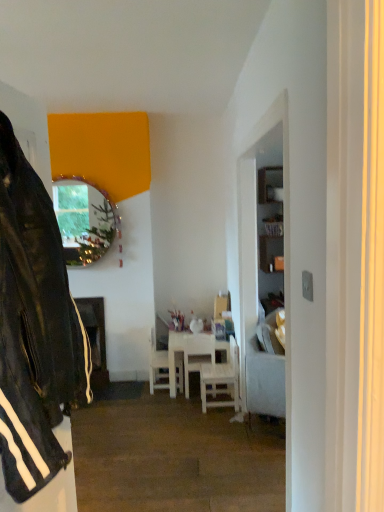
What do you see at coordinates (84, 220) in the screenshot?
I see `metallic reflective mirror at upper left` at bounding box center [84, 220].

Measure the distance between point (177, 356) and camera.

Point (177, 356) is 3.74 meters away from camera.

This screenshot has width=384, height=512. What do you see at coordinates (34, 328) in the screenshot? I see `black leather jacket at left` at bounding box center [34, 328].

What do you see at coordinates (192, 354) in the screenshot?
I see `white wooden table at center` at bounding box center [192, 354].

Describe the element at coordinates (197, 354) in the screenshot. I see `white wood chair at center, the 2th chair when ordered from right to left` at that location.

Image resolution: width=384 pixels, height=512 pixels. What are the coordinates of `metallic reflective mirror at upper left` in the screenshot? It's located at (84, 220).

Who is more distant, white wood chair at center, the 1th chair from the left, or white wood chair at center, which is the 2th chair from left to right?

white wood chair at center, the 1th chair from the left, is further from the camera.

Does point (155, 358) lie in front of point (186, 384)?

No.

Is white wood chair at center, the 1th chair from the left, with white wood chair at center, the 2th chair when ordered from right to left?

white wood chair at center, the 1th chair from the left, and white wood chair at center, the 2th chair when ordered from right to left, are clearly separated.

Is white wood chair at center, which is the 3th chair from right to left, oriented towards white wood chair at center, the 2th chair when ordered from right to left?

Yes, white wood chair at center, which is the 3th chair from right to left, is turned towards white wood chair at center, the 2th chair when ordered from right to left.

Where is `mirror above the black leather jacket at left (from a real-world perspective)`? The height and width of the screenshot is (512, 384). mirror above the black leather jacket at left (from a real-world perspective) is located at coordinates (84, 220).

Is black leather jacket at left at the left side of metallic reflective mirror at upper left?

Incorrect, black leather jacket at left is not on the left side of metallic reflective mirror at upper left.

From a real-world perspective, between black leather jacket at left and metallic reflective mirror at upper left, who is vertically lower?

black leather jacket at left, from a real-world perspective.

Measure the distance between black leather jacket at left and metallic reflective mirror at upper left.

2.49 meters.

Which is in front, point (63, 226) or point (227, 401)?

The point (227, 401) is more forward.

Can you confirm if metallic reflective mirror at upper left is wider than white wooden chair at center, which is the 1th chair from right to left?

Incorrect, the width of metallic reflective mirror at upper left does not surpass that of white wooden chair at center, which is the 1th chair from right to left.

Is the position of metallic reflective mirror at upper left less distant than that of white wooden chair at center, which ranks as the 3th chair in left-to-right order?

No, it is behind white wooden chair at center, which ranks as the 3th chair in left-to-right order.

Is metallic reflective mirror at upper left oriented away from white wooden chair at center, which ranks as the 3th chair in left-to-right order?

No, metallic reflective mirror at upper left is not facing away from white wooden chair at center, which ranks as the 3th chair in left-to-right order.

Based on the photo, can we say white wood chair at center, which is the 2th chair from left to right, lies outside white wooden chair at center, which ranks as the 3th chair in left-to-right order?

Yes.

Based on the photo, who is smaller, white wood chair at center, which is the 2th chair from left to right, or white wooden chair at center, which is the 1th chair from right to left?

With smaller size is white wood chair at center, which is the 2th chair from left to right.

How different are the orientations of white wood chair at center, the 2th chair when ordered from right to left, and white wooden chair at center, which is the 1th chair from right to left, in degrees?

87.8 degrees separate the facing orientations of white wood chair at center, the 2th chair when ordered from right to left, and white wooden chair at center, which is the 1th chair from right to left.

Is white wood chair at center, which is the 2th chair from left to right, placed right next to white wooden chair at center, which ranks as the 3th chair in left-to-right order?

white wood chair at center, which is the 2th chair from left to right, and white wooden chair at center, which ranks as the 3th chair in left-to-right order, are not in contact.

From the image's perspective, relative to black leather jacket at left, is light gray fabric couch at right above or below?

Clearly, from the image's perspective, light gray fabric couch at right is below black leather jacket at left.

Is light gray fabric couch at right behind black leather jacket at left?

Yes, light gray fabric couch at right is behind black leather jacket at left.

Can you confirm if light gray fabric couch at right is shorter than black leather jacket at left?

Yes.

You are a GUI agent. You are given a task and a screenshot of the screen. Output one action in this format:
    pyautogui.click(x=<x>, y=<y>)
    Task: Click on the leather jacket that appears on the left of light gray fabric couch at right
    
    Given the screenshot: What is the action you would take?
    pyautogui.click(x=34, y=328)

Which of these two, white wood chair at center, which is the 2th chair from left to right, or black leather jacket at left, is thinner?

Thinner between the two is black leather jacket at left.

From a real-world perspective, between white wood chair at center, which is the 2th chair from left to right, and black leather jacket at left, who is vertically lower?

white wood chair at center, which is the 2th chair from left to right, from a real-world perspective.

Is white wood chair at center, which is the 2th chair from left to right, far away from black leather jacket at left?

Yes, white wood chair at center, which is the 2th chair from left to right, is far from black leather jacket at left.

Image resolution: width=384 pixels, height=512 pixels. There is a black leather jacket at left. What are the coordinates of `the 2nd chair below it (from a real-world perspective)` in the screenshot? It's located at (197, 354).

From the image's perspective, is white wood chair at center, which is the 3th chair from right to left, beneath light gray fabric couch at right?

Yes.

Is light gray fabric couch at right at the back of white wood chair at center, the 1th chair from the left?

No, light gray fabric couch at right is not at the back of white wood chair at center, the 1th chair from the left.

How many degrees apart are the facing directions of white wood chair at center, which is the 3th chair from right to left, and light gray fabric couch at right?

26.2 degrees separate the facing orientations of white wood chair at center, which is the 3th chair from right to left, and light gray fabric couch at right.

This screenshot has height=512, width=384. Identify the location of the 1st chair below the white wood chair at center, the 1th chair from the left (from the image's perspective). (197, 354).

I want to click on mirror that appears behind the black leather jacket at left, so click(x=84, y=220).

Considering their positions, is white wooden table at center positioned further to light gray fabric couch at right than white wooden chair at center, which is the 1th chair from right to left?

white wooden table at center is positioned further to the anchor light gray fabric couch at right.

Estimate the real-world distances between objects in this image. Which object is further from white wood chair at center, which is the 2th chair from left to right, metallic reflective mirror at upper left or black leather jacket at left?

black leather jacket at left lies further to white wood chair at center, which is the 2th chair from left to right, than the other object.

Which object lies further to the anchor point white wooden table at center, white wood chair at center, the 2th chair when ordered from right to left, or black leather jacket at left?

Based on the image, black leather jacket at left appears to be further to white wooden table at center.

Based on the photo, considering their positions, is white wood chair at center, which is the 2th chair from left to right, positioned further to white wooden chair at center, which is the 1th chair from right to left, than white wooden table at center?

Among the two, white wood chair at center, which is the 2th chair from left to right, is located further to white wooden chair at center, which is the 1th chair from right to left.

Considering their positions, is metallic reflective mirror at upper left positioned closer to white wood chair at center, which is the 3th chair from right to left, than white wood chair at center, the 2th chair when ordered from right to left?

white wood chair at center, the 2th chair when ordered from right to left, is positioned closer to the anchor white wood chair at center, which is the 3th chair from right to left.

Estimate the real-world distances between objects in this image. Which object is closer to metallic reflective mirror at upper left, white wooden table at center or white wooden chair at center, which is the 1th chair from right to left?

white wooden table at center.

Considering their positions, is metallic reflective mirror at upper left positioned further to white wood chair at center, which is the 3th chair from right to left, than white wooden table at center?

metallic reflective mirror at upper left is further to white wood chair at center, which is the 3th chair from right to left.

From the image, which object appears to be nearer to light gray fabric couch at right, white wood chair at center, which is the 3th chair from right to left, or metallic reflective mirror at upper left?

white wood chair at center, which is the 3th chair from right to left, lies closer to light gray fabric couch at right than the other object.

The height and width of the screenshot is (512, 384). Identify the location of chair positioned between light gray fabric couch at right and white wood chair at center, which is the 2th chair from left to right, from near to far. point(221,381).

The image size is (384, 512). In order to click on chair located between white wooden chair at center, which is the 1th chair from right to left, and white wooden table at center in the depth direction in this screenshot , I will do `click(197, 354)`.

Locate an element on the screen. The width and height of the screenshot is (384, 512). table located between black leather jacket at left and metallic reflective mirror at upper left in the depth direction is located at coordinates (192, 354).

The width and height of the screenshot is (384, 512). Find the location of `studio couch between black leather jacket at left and white wood chair at center, the 1th chair from the left, from front to back`. studio couch between black leather jacket at left and white wood chair at center, the 1th chair from the left, from front to back is located at coordinates (265, 370).